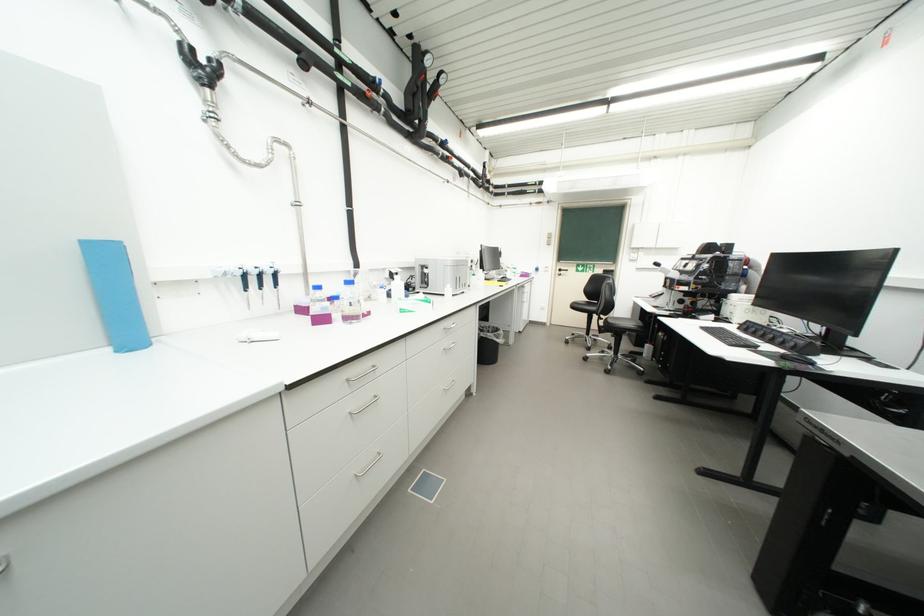
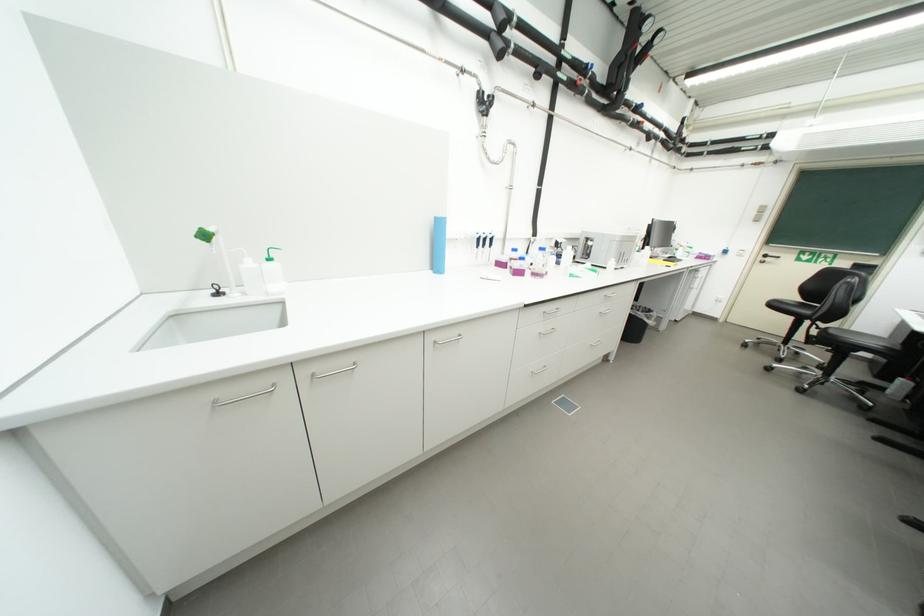
Locate, in the second image, the point that corresponds to [310,312] in the first image.

(507, 265)